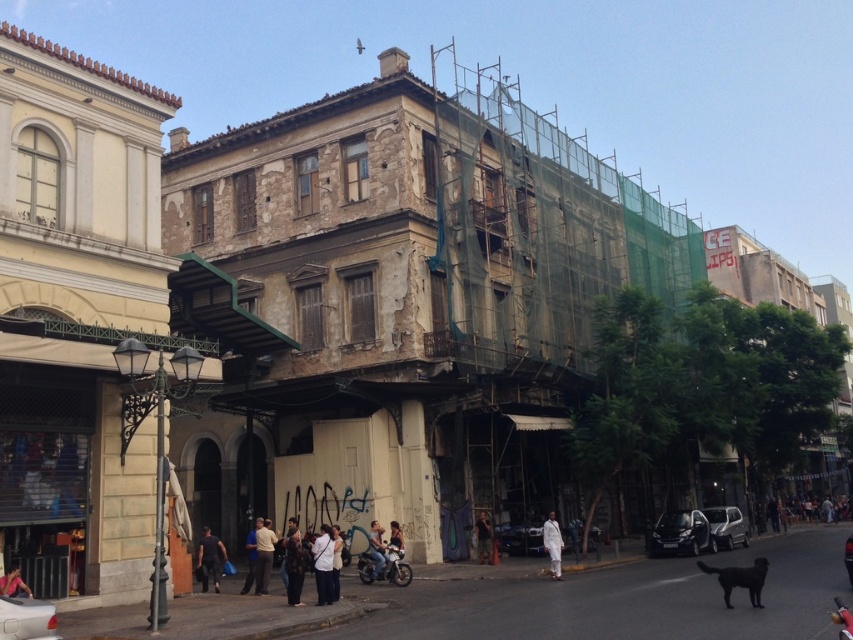
You are a delivery person standing at the entrance of the modern building with arched doorways and windows. You need to deliver a package to the exact location where the light brown leather jacket at center is located. According to the coordinates provided, can you determine the direction you should walk from your current position to reach the jacket?

The coordinates of the light brown leather jacket at center are at point 0.869 on the x axis and 0.309 on the y axis. Since you are at the entrance of the modern building which is to the left of the old building, and the jacket is at the center of the image, you should walk towards the right direction to reach it.

You are a fashion designer observing a passerby dressed in a white matte shirt at center and dark blue jeans at center. Which clothing item is wider?

The white matte shirt at center is wider than the dark blue jeans at center.

You are standing at the streetlamp with a classic design on the modern building side. You see two points marked in the scene. Which point is closer to you, point [270,520] or point [401,545]?

Point [401,545] is closer to you because point [270,520] is behind it.